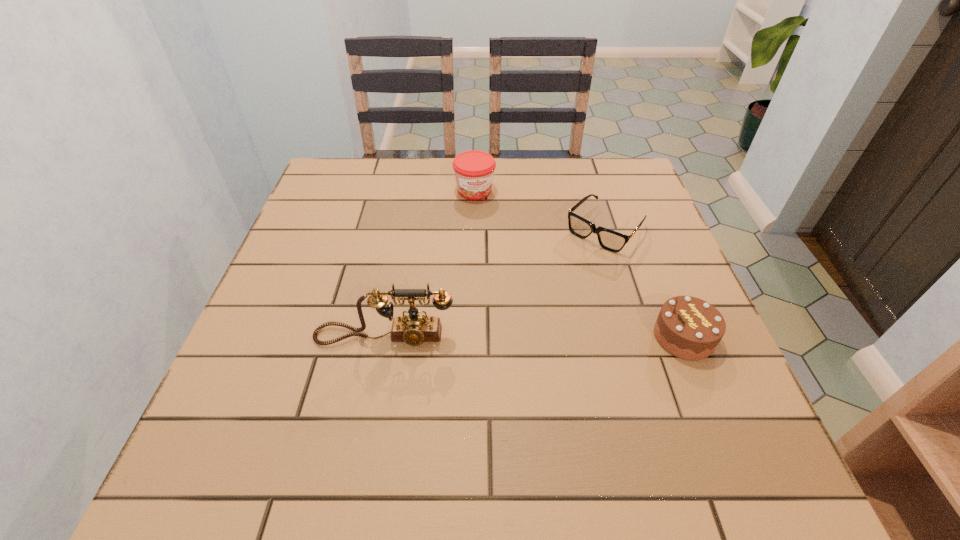
Identify the location of vacant area that lies between the telephone and the chocolate cake. (534, 336).

Identify the location of free space between the chocolate cake and the tallest object. This screenshot has width=960, height=540. (534, 336).

I want to click on free space between the tallest object and the chocolate cake, so click(534, 336).

The height and width of the screenshot is (540, 960). Find the location of `object that can be found as the second closest to the sunglasses`. object that can be found as the second closest to the sunglasses is located at coordinates (687, 327).

Identify which object is the second nearest to the chocolate cake. Please provide its 2D coordinates. Your answer should be formatted as a tuple, i.e. [(x, y)], where the tuple contains the x and y coordinates of a point satisfying the conditions above.

[(414, 328)]

Where is `vacant space that satisfies the following two spatial constraints: 1. on the front-facing side of the telephone; 2. on the left side of the chocolate cake`? This screenshot has height=540, width=960. vacant space that satisfies the following two spatial constraints: 1. on the front-facing side of the telephone; 2. on the left side of the chocolate cake is located at coordinates (384, 337).

Where is `vacant position in the image that satisfies the following two spatial constraints: 1. on the front side of the chocolate cake; 2. on the left side of the second farthest object`? Image resolution: width=960 pixels, height=540 pixels. vacant position in the image that satisfies the following two spatial constraints: 1. on the front side of the chocolate cake; 2. on the left side of the second farthest object is located at coordinates (639, 337).

Image resolution: width=960 pixels, height=540 pixels. I want to click on free region that satisfies the following two spatial constraints: 1. on the front side of the sunglasses; 2. on the right side of the farthest object, so click(474, 229).

This screenshot has height=540, width=960. I want to click on vacant space that satisfies the following two spatial constraints: 1. on the front side of the chocolate cake; 2. on the left side of the farthest object, so click(x=472, y=337).

Identify the location of free location that satisfies the following two spatial constraints: 1. on the front side of the second farthest object; 2. on the right side of the farthest object. Image resolution: width=960 pixels, height=540 pixels. (474, 229).